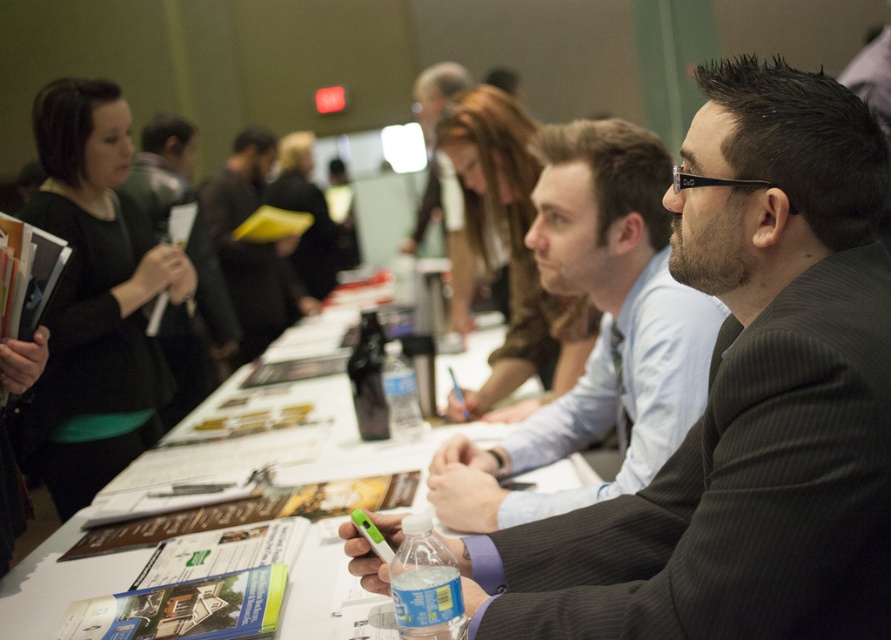
You are standing in front of the long table at the conference. You notice two points marked on the table. The first point is at coordinates [421,602] and the second point is at [375,392]. Which point is closer to you?

Point [421,602] is closer to the camera than point [375,392], so the first point is closer to you.

In the scene shown: You are a participant at this conference and need to choose between the translucent plastic water bottle at center and the clear plastic bottle at center. Which one is taller?

The clear plastic bottle at center is taller than the translucent plastic water bottle at center.

You are standing at the point marked by the coordinates point (395, 364) and want to move to the point marked by point (235, 195). Is the point you want to reach located behind you or in front of you?

The point marked by point (235, 195) is behind point (395, 364), so the destination is behind you.